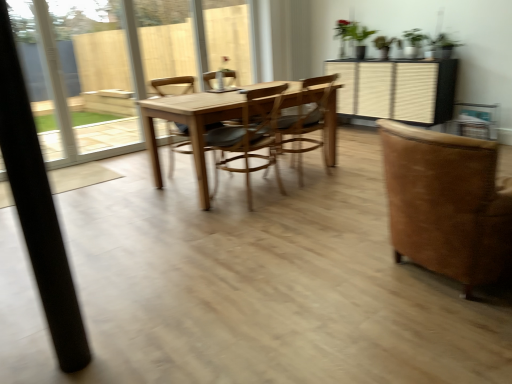
Question: Considering the relative sizes of wooden at center, which is the 3th chair in right-to-left order, and green matte plant at upper center in the image provided, is wooden at center, which is the 3th chair in right-to-left order, thinner than green matte plant at upper center?

Choices:
 (A) yes
 (B) no

Answer: (B)

Question: From a real-world perspective, is wooden at center, arranged as the 2th chair when viewed from the left, located higher than green matte plant at upper center?

Choices:
 (A) yes
 (B) no

Answer: (B)

Question: Does wooden at center, which is the 3th chair in right-to-left order, appear on the left side of green matte plant at upper center?

Choices:
 (A) no
 (B) yes

Answer: (B)

Question: Is wooden at center, which is the 3th chair in right-to-left order, next to green matte plant at upper center?

Choices:
 (A) yes
 (B) no

Answer: (B)

Question: Is wooden at center, arranged as the 2th chair when viewed from the left, not within green matte plant at upper center?

Choices:
 (A) yes
 (B) no

Answer: (A)

Question: Looking at their shapes, would you say brown suede chair at right, which ranks as the first chair in right-to-left order, is wider or thinner than wooden chair at center, the 4th chair in the right-to-left sequence?

Choices:
 (A) thin
 (B) wide

Answer: (B)

Question: In terms of size, does brown suede chair at right, the fourth chair from the left, appear bigger or smaller than wooden chair at center, the 4th chair in the right-to-left sequence?

Choices:
 (A) big
 (B) small

Answer: (A)

Question: From a real-world perspective, relative to wooden chair at center, the 4th chair in the right-to-left sequence, is brown suede chair at right, which ranks as the first chair in right-to-left order, vertically above or below?

Choices:
 (A) below
 (B) above

Answer: (A)

Question: In the image, is brown suede chair at right, which ranks as the first chair in right-to-left order, positioned in front of or behind wooden chair at center, the 4th chair in the right-to-left sequence?

Choices:
 (A) behind
 (B) front

Answer: (B)

Question: Visually, is wooden at center, arranged as the 2th chair when viewed from the left, positioned to the left or to the right of wooden chair at center, the 4th chair in the right-to-left sequence?

Choices:
 (A) left
 (B) right

Answer: (B)

Question: From the image's perspective, is wooden at center, which is the 3th chair in right-to-left order, positioned above or below wooden chair at center, the 4th chair in the right-to-left sequence?

Choices:
 (A) above
 (B) below

Answer: (B)

Question: Is wooden at center, arranged as the 2th chair when viewed from the left, taller or shorter than wooden chair at center, positioned as the first chair in left-to-right order?

Choices:
 (A) short
 (B) tall

Answer: (A)

Question: Is wooden at center, which is the 3th chair in right-to-left order, inside the boundaries of wooden chair at center, the 4th chair in the right-to-left sequence, or outside?

Choices:
 (A) inside
 (B) outside

Answer: (B)

Question: From a real-world perspective, is green matte plant at upper center positioned above or below wooden at center, which is the 3th chair in right-to-left order?

Choices:
 (A) below
 (B) above

Answer: (B)

Question: Considering the positions of green matte plant at upper center and wooden at center, which is the 3th chair in right-to-left order, in the image, is green matte plant at upper center taller or shorter than wooden at center, which is the 3th chair in right-to-left order,?

Choices:
 (A) tall
 (B) short

Answer: (B)